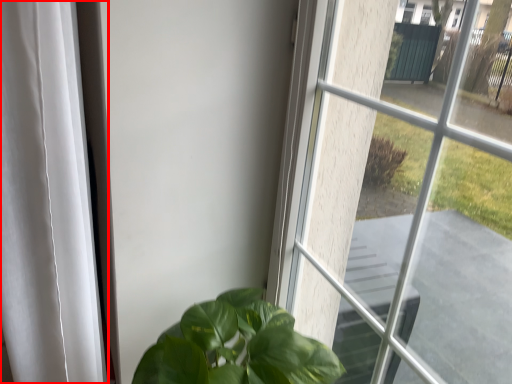
Question: Observing the image, what is the correct spatial positioning of curtain (annotated by the red box) in reference to window?

Choices:
 (A) right
 (B) left

Answer: (B)